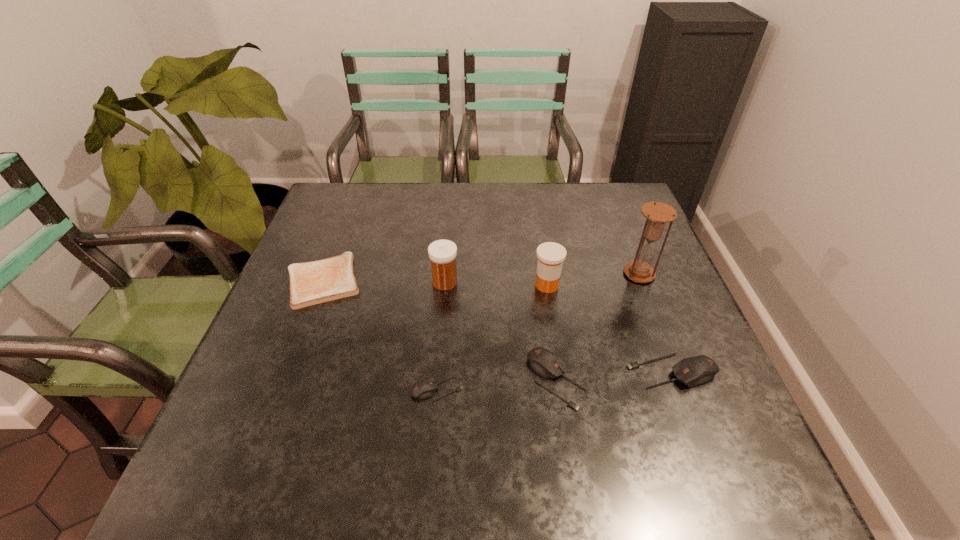
In order to click on vacant region located 0.130m on the back of the leftmost mouse in this screenshot , I will do `click(442, 329)`.

Image resolution: width=960 pixels, height=540 pixels. I want to click on free location located on the right of the second tallest mouse, so click(x=647, y=380).

Find the location of a particular element. vacant space situated on the left of the rightmost mouse is located at coordinates pos(481,371).

Image resolution: width=960 pixels, height=540 pixels. Find the location of `vacant space located 0.140m on the back of the left medicine`. vacant space located 0.140m on the back of the left medicine is located at coordinates (448, 240).

Find the location of a particular element. free space located 0.060m on the label of the right medicine is located at coordinates (510, 285).

Image resolution: width=960 pixels, height=540 pixels. Find the location of `blank space located on the label of the right medicine`. blank space located on the label of the right medicine is located at coordinates (506, 285).

The image size is (960, 540). Find the location of `vacant space located 0.220m on the label of the right medicine`. vacant space located 0.220m on the label of the right medicine is located at coordinates (446, 285).

Where is `vacant space situated on the right of the shortest object`? vacant space situated on the right of the shortest object is located at coordinates (390, 281).

The width and height of the screenshot is (960, 540). I want to click on free space located 0.390m on the front of the tallest object, so click(699, 427).

This screenshot has width=960, height=540. I want to click on object at the left edge, so click(315, 282).